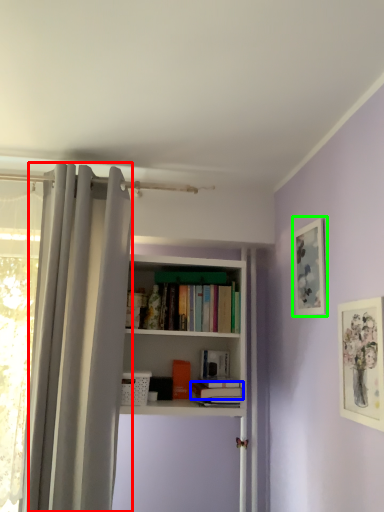
Question: Based on their relative distances, which object is farther from curtain (highlighted by a red box)? Choose from book (highlighted by a blue box) and picture frame (highlighted by a green box).

Choices:
 (A) book
 (B) picture frame

Answer: (B)